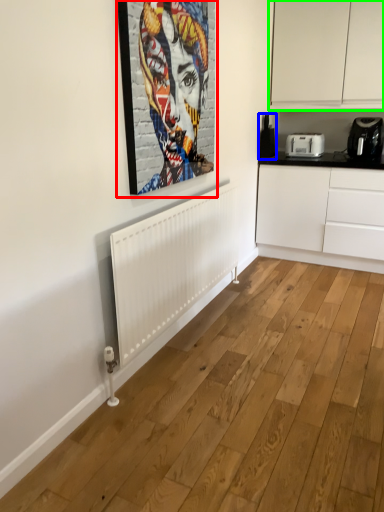
Question: Which object is the farthest from picture frame (highlighted by a red box)? Choose among these: appliance (highlighted by a blue box) or cabinetry (highlighted by a green box).

Choices:
 (A) appliance
 (B) cabinetry

Answer: (A)